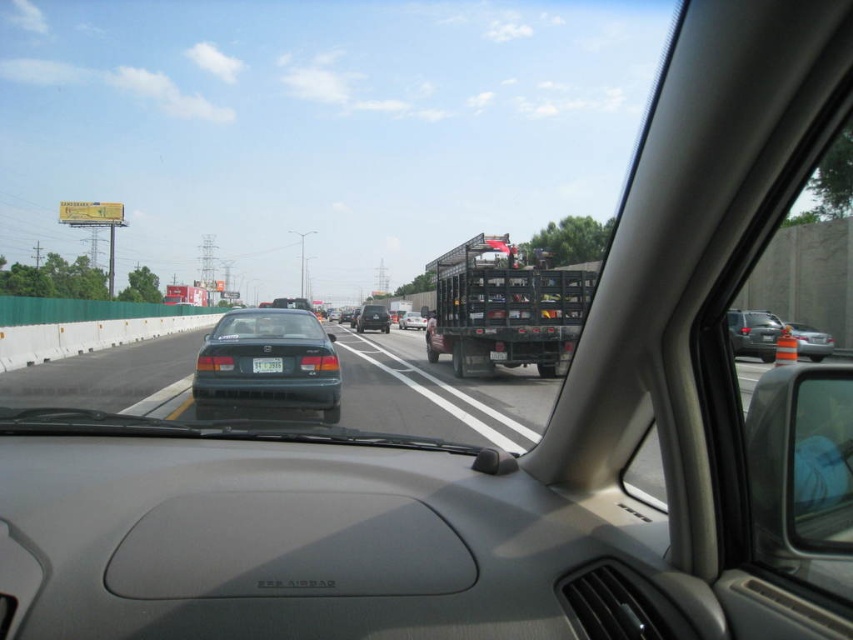
Is metallic black trailer truck at center taller than white plastic license plate at center?

Indeed, metallic black trailer truck at center has a greater height compared to white plastic license plate at center.

Is point (569, 307) less distant than point (253, 369)?

That is False.

This screenshot has width=853, height=640. Find the location of `metallic black trailer truck at center`. metallic black trailer truck at center is located at coordinates (503, 308).

Can you confirm if transparent blue windshield at lower right is smaller than green matte sedan at center?

Yes.

Is point (844, 540) less distant than point (410, 321)?

Yes, point (844, 540) is in front of point (410, 321).

Which is in front, point (846, 534) or point (410, 317)?

Point (846, 534) is in front.

This screenshot has height=640, width=853. Identify the location of transparent blue windshield at lower right. (820, 461).

What do you see at coordinates (503, 308) in the screenshot? The width and height of the screenshot is (853, 640). I see `metallic black trailer truck at center` at bounding box center [503, 308].

Is metallic black trailer truck at center to the left of transparent blue windshield at lower right from the viewer's perspective?

In fact, metallic black trailer truck at center is to the right of transparent blue windshield at lower right.

Find the location of a particular element. This screenshot has width=853, height=640. metallic black trailer truck at center is located at coordinates (503, 308).